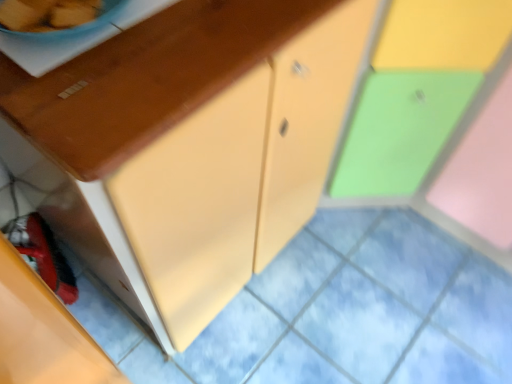
The height and width of the screenshot is (384, 512). What do you see at coordinates (47, 14) in the screenshot?
I see `blue glossy bowl at upper left` at bounding box center [47, 14].

Where is `blue glossy bowl at upper left`? The image size is (512, 384). blue glossy bowl at upper left is located at coordinates (47, 14).

Identify the location of blue glossy bowl at upper left. (47, 14).